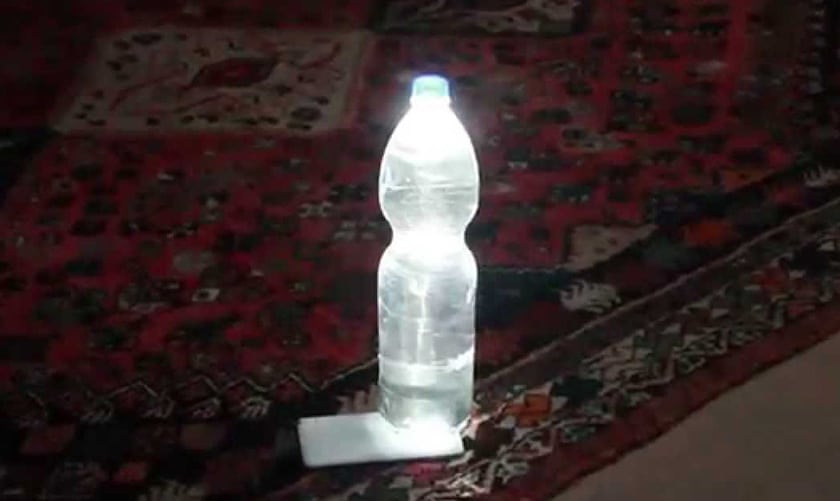
Locate an element on the screen. floor is located at coordinates (722, 473).